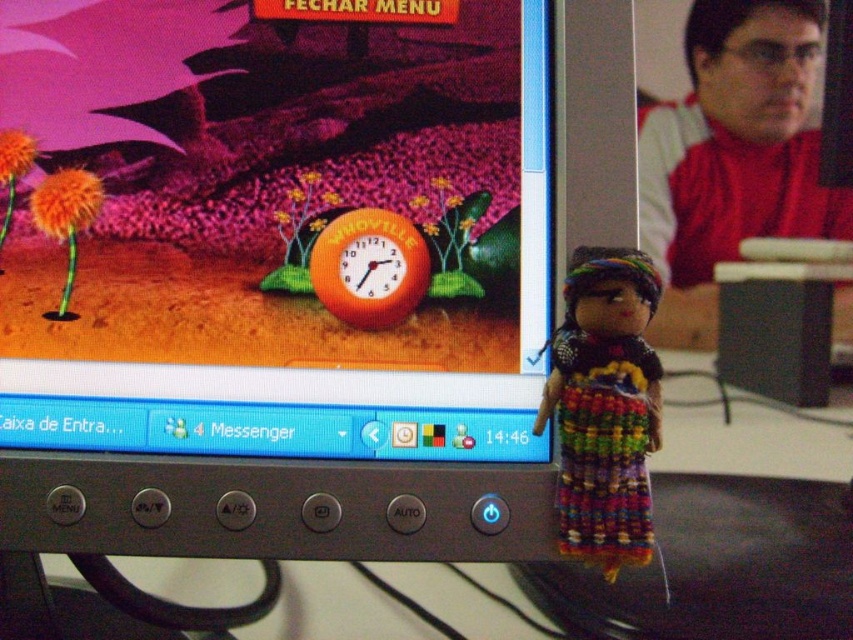
Between knitted multicolored doll at right and orange fabric clock at center, which one appears on the right side from the viewer's perspective?

knitted multicolored doll at right

Consider the image. Who is more distant from viewer, (582,483) or (343,280)?

Positioned behind is point (343,280).

What are the coordinates of `knitted multicolored doll at right` in the screenshot? It's located at click(605, 406).

Is matte plastic monitor at center wider than fluffy orange flower at left?

Yes, matte plastic monitor at center is wider than fluffy orange flower at left.

Does matte plastic monitor at center have a smaller size compared to fluffy orange flower at left?

No.

Is point (328, 118) behind point (67, 320)?

Yes, it is behind point (67, 320).

Where is `matte plastic monitor at center`? The height and width of the screenshot is (640, 853). matte plastic monitor at center is located at coordinates (279, 227).

Which is in front, point (469, 326) or point (746, 96)?

Point (469, 326) is in front.

Does matte plastic monitor at center appear under smooth red shirt at right?

Yes.

This screenshot has width=853, height=640. Describe the element at coordinates (279, 227) in the screenshot. I see `matte plastic monitor at center` at that location.

Find the location of a particular element. matte plastic monitor at center is located at coordinates (279, 227).